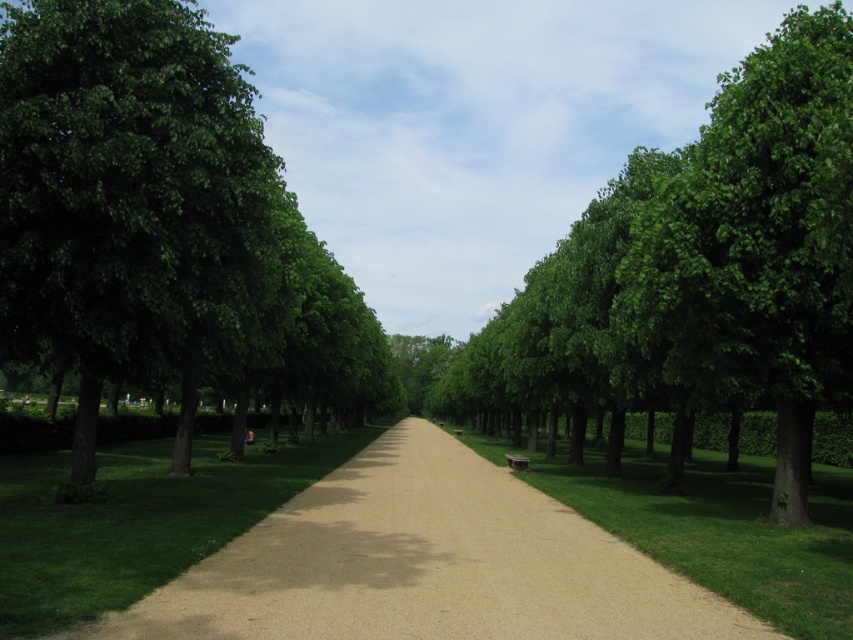
Can you confirm if green leafy tree at center is thinner than green grass at center?

In fact, green leafy tree at center might be wider than green grass at center.

Which is in front, point (784, 436) or point (561, 468)?

Point (784, 436) is in front.

Identify the location of green leafy tree at center. The width and height of the screenshot is (853, 640). (701, 268).

Who is more distant from viewer, (735, 147) or (51, 570)?

Point (735, 147)

Is green leafy tree at center smaller than green grass at left?

Actually, green leafy tree at center might be larger than green grass at left.

What are the coordinates of `green leafy tree at center` in the screenshot? It's located at (701, 268).

From the picture: Can you confirm if green leafy tree at left is thinner than brown gravel path at center?

No, green leafy tree at left is not thinner than brown gravel path at center.

Who is shorter, green leafy tree at left or brown gravel path at center?

Standing shorter between the two is brown gravel path at center.

You are a GUI agent. You are given a task and a screenshot of the screen. Output one action in this format:
    pyautogui.click(x=<x>, y=<y>)
    Task: Click on the green leafy tree at left
    
    Given the screenshot: What is the action you would take?
    [x=160, y=220]

Identify the location of green leafy tree at left. (160, 220).